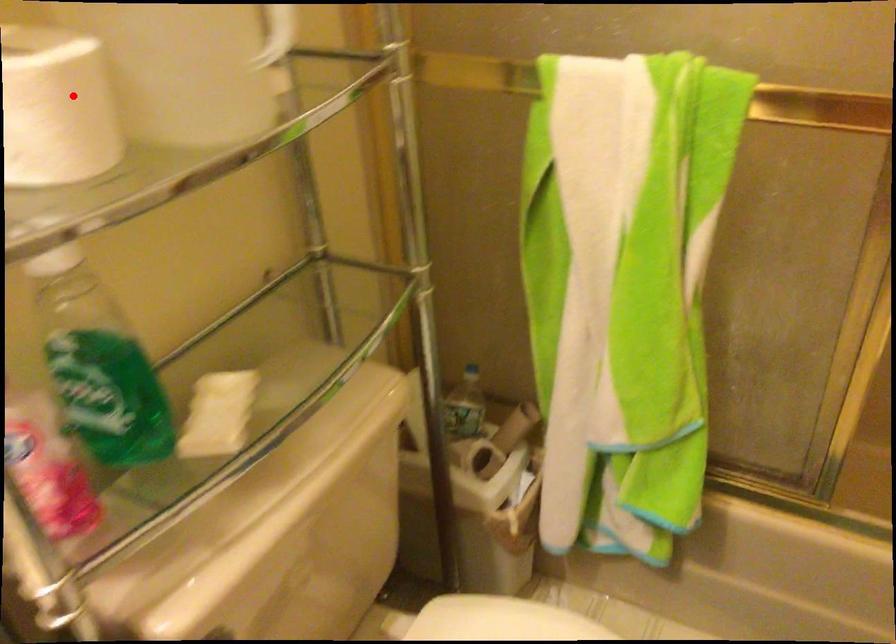
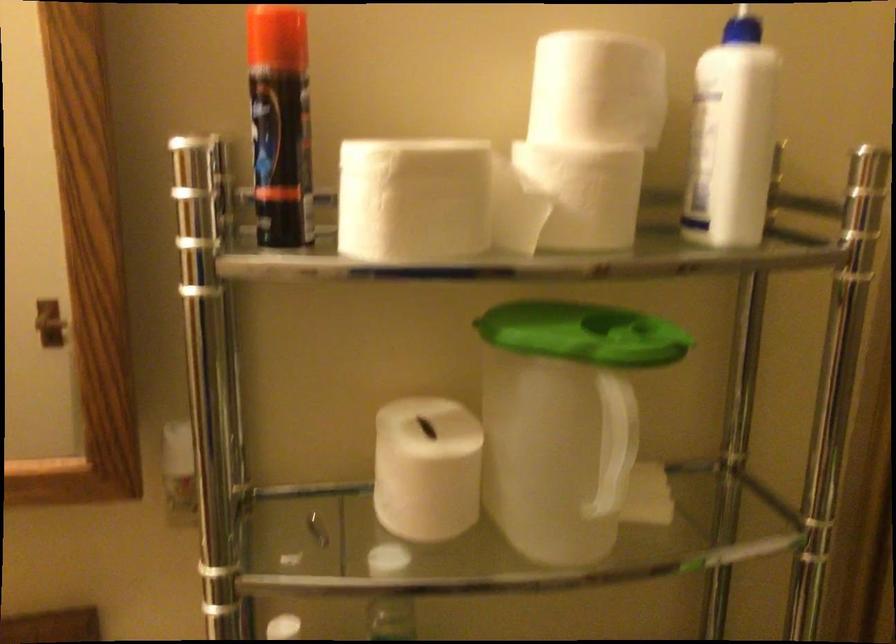
Question: I am providing you with two images of the same scene from different viewpoints. Given a red point in image1, look at the same physical point in image2. Is it:

Choices:
 (A) Closer to the viewpoint
 (B) Farther from the viewpoint

Answer: (B)